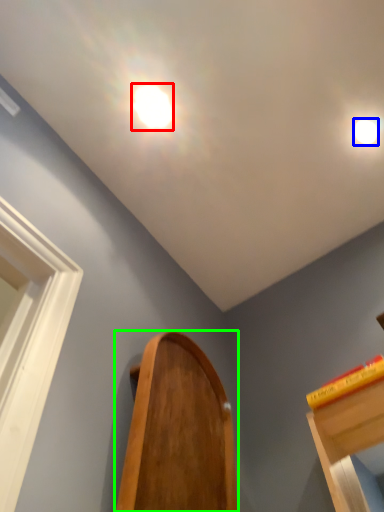
Question: Which object is positioned closest to droplight (highlighted by a red box)? Select from droplight (highlighted by a blue box) and furniture (highlighted by a green box).

Choices:
 (A) droplight
 (B) furniture

Answer: (A)